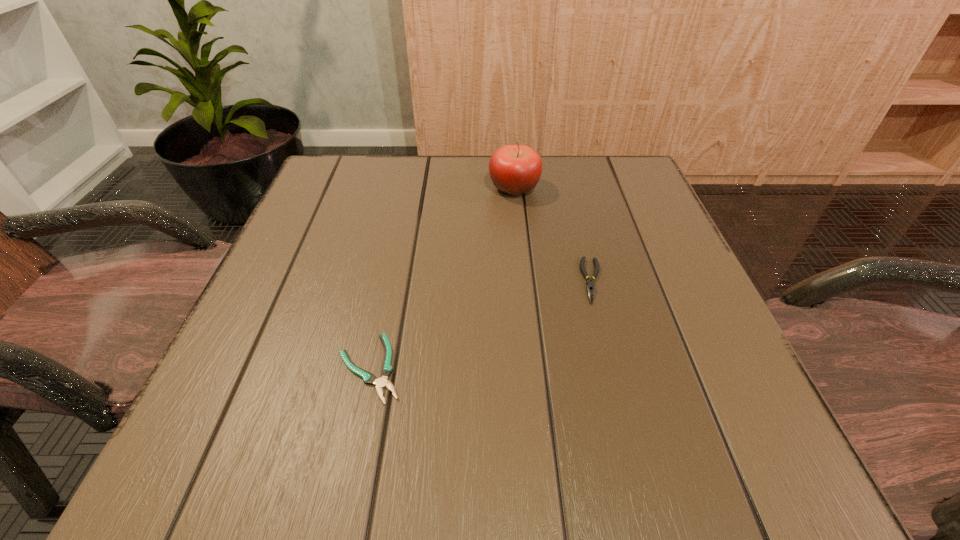
In order to click on free location at the far edge of the desktop in this screenshot , I will do pos(417,172).

Image resolution: width=960 pixels, height=540 pixels. What are the coordinates of `vacant space at the near edge` in the screenshot? It's located at (305, 470).

The width and height of the screenshot is (960, 540). In the image, there is a desktop. Find the location of `vacant space at the left edge`. vacant space at the left edge is located at coordinates (344, 262).

You are a GUI agent. You are given a task and a screenshot of the screen. Output one action in this format:
    pyautogui.click(x=<x>, y=<y>)
    Task: Click on the vacant position at the right edge of the desktop
    
    Given the screenshot: What is the action you would take?
    pyautogui.click(x=669, y=350)

Locate an element on the screen. The width and height of the screenshot is (960, 540). free region at the far left corner is located at coordinates (381, 171).

At what (x,y) coordinates should I click in order to perform the action: click on vacant space at the far right corner. Please return your answer as a coordinate pair (x, y). Looking at the image, I should click on (612, 179).

Where is `free space between the apple and the shorter pliers`? The image size is (960, 540). free space between the apple and the shorter pliers is located at coordinates (442, 278).

The image size is (960, 540). What are the coordinates of `vacant area that lies between the second tallest object and the nearest object` in the screenshot? It's located at (481, 325).

This screenshot has height=540, width=960. What are the coordinates of `vacant space in between the nearer pliers and the second object from left to right` in the screenshot? It's located at (442, 278).

The height and width of the screenshot is (540, 960). Identify the location of free point between the rightmost object and the apple. (553, 234).